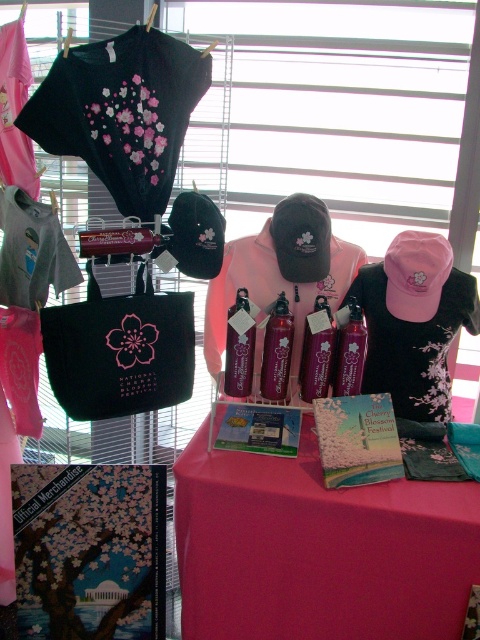
Can you confirm if shiny pink spray bottle at center is taller than shiny purple bottle at center?

Indeed, shiny pink spray bottle at center has a greater height compared to shiny purple bottle at center.

This screenshot has width=480, height=640. Describe the element at coordinates (276, 352) in the screenshot. I see `shiny pink spray bottle at center` at that location.

Is point (268, 368) positioned after point (337, 392)?

No, (268, 368) is closer to viewer.

Locate an element on the screen. This screenshot has height=640, width=480. shiny pink spray bottle at center is located at coordinates (276, 352).

Who is more distant from viewer, [460,611] or [389,342]?

Point [389,342]

Between pink fabric tablecloth at center and pink fabric dress at center, which one has less height?

pink fabric dress at center is shorter.

Describe the element at coordinates (317, 548) in the screenshot. I see `pink fabric tablecloth at center` at that location.

Where is `pink fabric tablecloth at center`? Image resolution: width=480 pixels, height=640 pixels. pink fabric tablecloth at center is located at coordinates (317, 548).

What do you see at coordinates (276, 352) in the screenshot?
I see `shiny pink spray bottle at center` at bounding box center [276, 352].

Is shiny pink spray bottle at center below translucent pink spray bottle at center?

Yes, shiny pink spray bottle at center is below translucent pink spray bottle at center.

What do you see at coordinates (276, 352) in the screenshot? I see `shiny pink spray bottle at center` at bounding box center [276, 352].

This screenshot has width=480, height=640. In order to click on shiny pink spray bottle at center in this screenshot , I will do `click(276, 352)`.